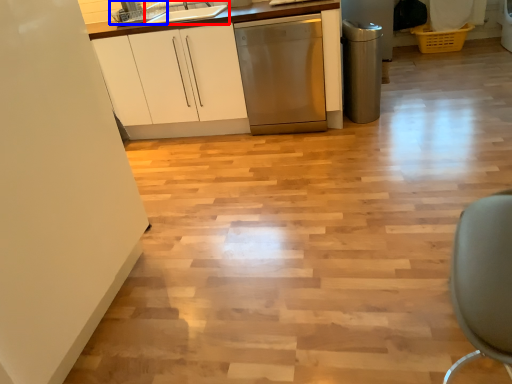
Question: Which of the following is the farthest to the observer, sink (highlighted by a red box) or appliance (highlighted by a blue box)?

Choices:
 (A) sink
 (B) appliance

Answer: (B)